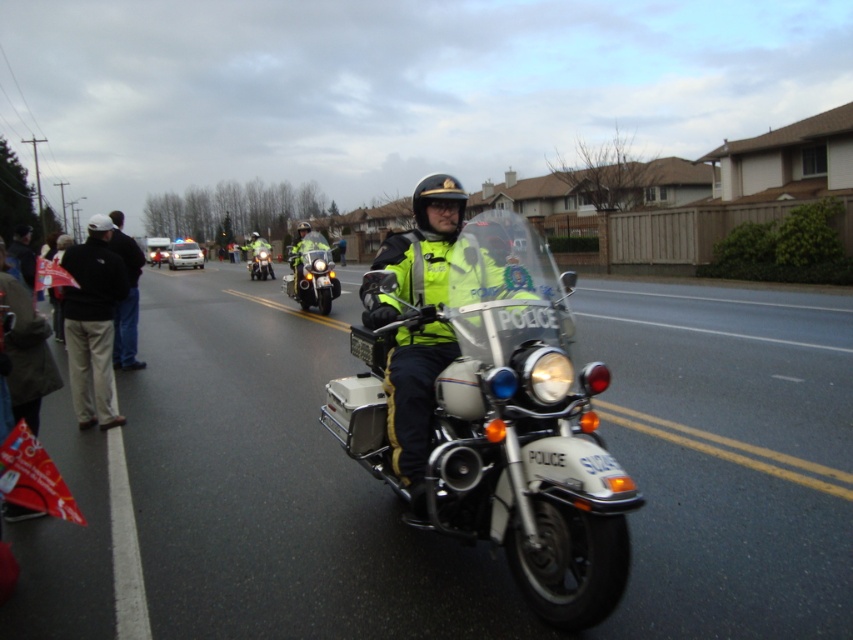
Is point (129, 342) in front of point (253, 257)?

Yes, point (129, 342) is closer to viewer.

Does black fabric jacket at left appear on the right side of shiny chrome motorcycle at center?

Yes, black fabric jacket at left is to the right of shiny chrome motorcycle at center.

Between point (134, 259) and point (248, 252), which one is positioned behind?

Point (248, 252)

I want to click on black fabric jacket at left, so click(126, 298).

Is white metallic police motorcycle at center positioned before shiny chrome motorcycle at center?

Yes, white metallic police motorcycle at center is closer to the viewer.

Based on the photo, is white metallic police motorcycle at center further to the viewer compared to shiny chrome motorcycle at center?

No, it is not.

I want to click on white metallic police motorcycle at center, so click(496, 417).

Where is `white metallic police motorcycle at center`? The height and width of the screenshot is (640, 853). white metallic police motorcycle at center is located at coordinates (496, 417).

Who is more distant from viewer, (453, 289) or (300, 268)?

Point (300, 268)

Where is `reflective yellow vest at center`? reflective yellow vest at center is located at coordinates (422, 253).